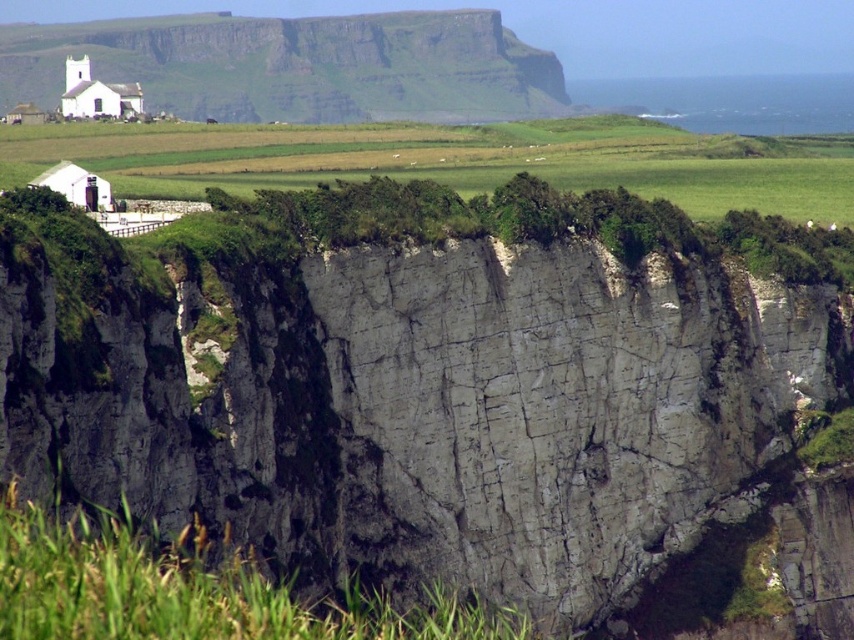
The height and width of the screenshot is (640, 854). In order to click on gray rough cliff at center in this screenshot , I will do `click(453, 397)`.

Identify the location of gray rough cliff at center. The width and height of the screenshot is (854, 640). (453, 397).

You are a GUI agent. You are given a task and a screenshot of the screen. Output one action in this format:
    pyautogui.click(x=<x>, y=<y>)
    Task: Click on the gray rough cliff at center
    The width and height of the screenshot is (854, 640).
    Given the screenshot: What is the action you would take?
    pyautogui.click(x=453, y=397)